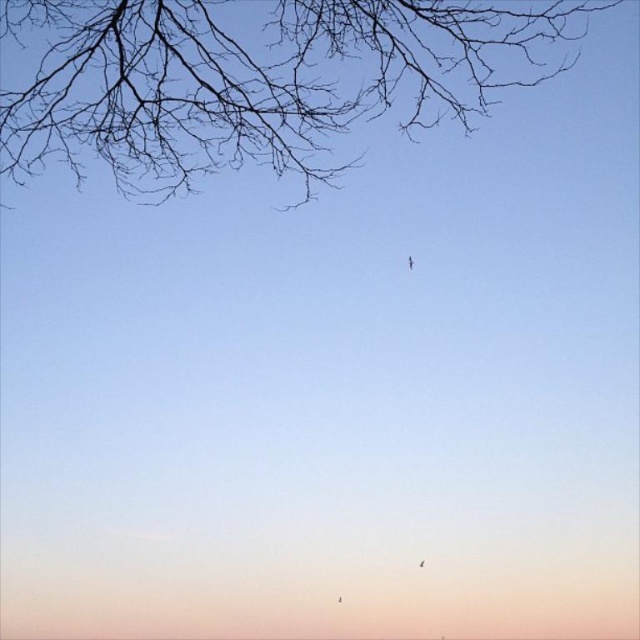
Is brown branches at upper left to the left of transparent plastic kite at center from the viewer's perspective?

Yes, brown branches at upper left is to the left of transparent plastic kite at center.

Measure the distance from brown branches at upper left to transparent plastic kite at center.

They are 1.78 meters apart.

Does point (44, 24) lie behind point (410, 268)?

Yes, point (44, 24) is behind point (410, 268).

Locate an element on the screen. brown branches at upper left is located at coordinates [253, 81].